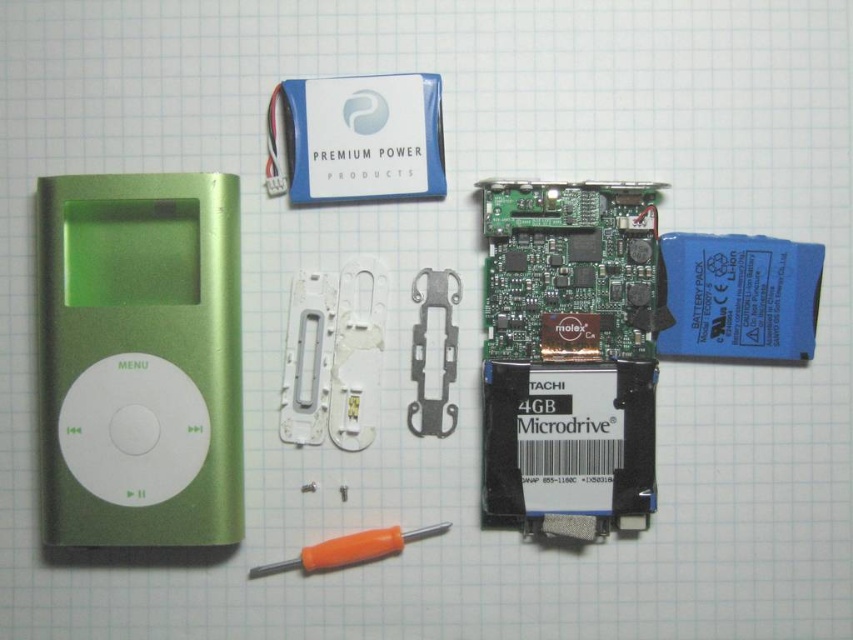
How far apart are green metallic ipod at left and orange plastic screwdriver at center?

green metallic ipod at left is 9.32 inches from orange plastic screwdriver at center.

Can you confirm if green metallic ipod at left is positioned to the right of orange plastic screwdriver at center?

Incorrect, green metallic ipod at left is not on the right side of orange plastic screwdriver at center.

Is point (51, 296) positioned in front of point (444, 525)?

Yes, point (51, 296) is in front of point (444, 525).

Find the location of a particular element. The width and height of the screenshot is (853, 640). green metallic ipod at left is located at coordinates (140, 358).